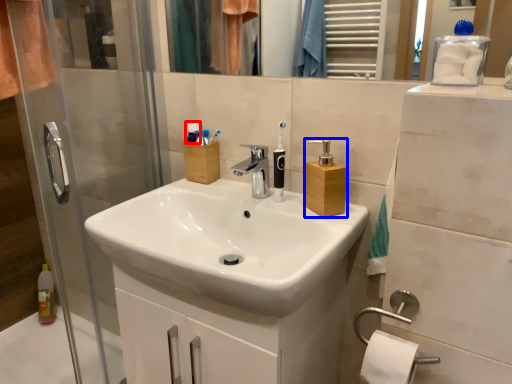
Question: Which object is closer to the camera taking this photo, toiletry (highlighted by a red box) or soap dispenser (highlighted by a blue box)?

Choices:
 (A) toiletry
 (B) soap dispenser

Answer: (B)